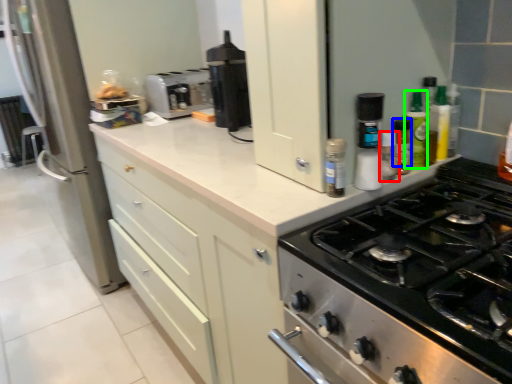
Question: Which object is the closest to the bottle (highlighted by a red box)? Choose among these: bottle (highlighted by a blue box) or bottle (highlighted by a green box).

Choices:
 (A) bottle
 (B) bottle

Answer: (A)